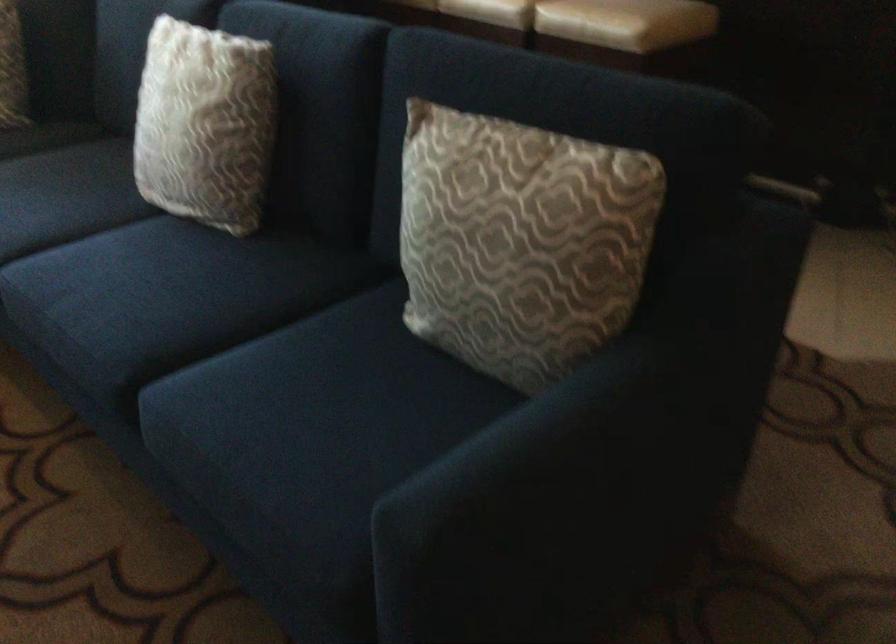
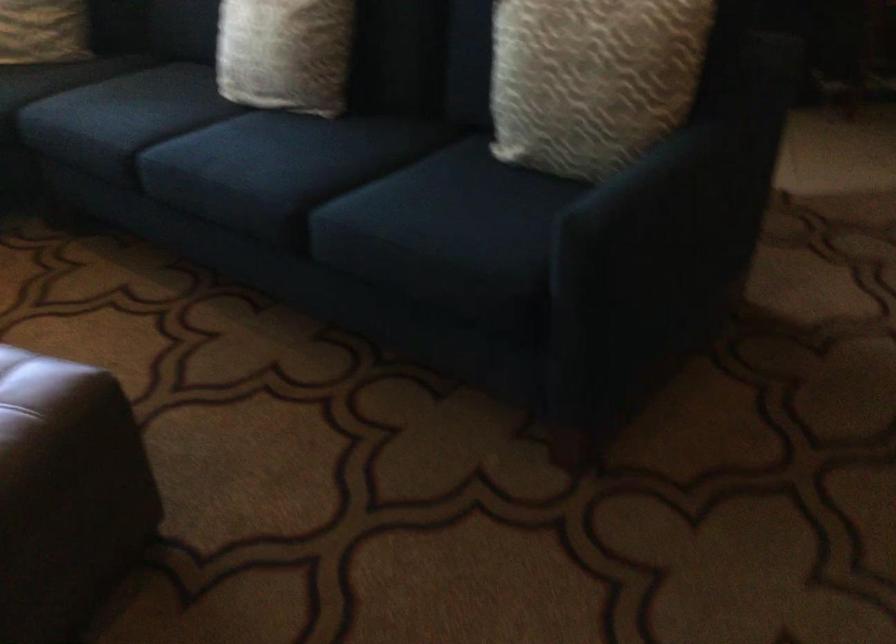
In the second image, find the point that corresponds to (x=592, y=440) in the first image.

(687, 190)